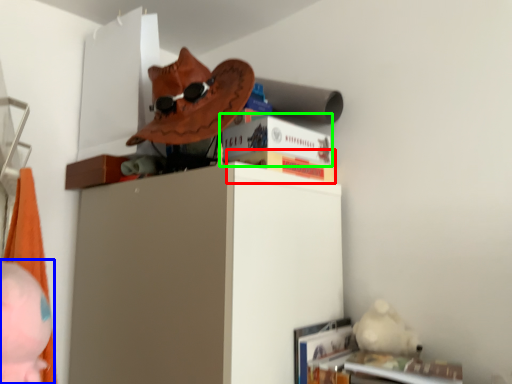
Question: Which object is positioned farthest from paperback book (highlighted by a red box)? Select from person (highlighted by a blue box) and paperback book (highlighted by a green box).

Choices:
 (A) person
 (B) paperback book

Answer: (A)